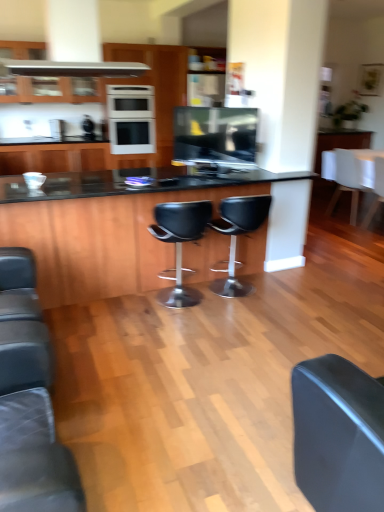
Image resolution: width=384 pixels, height=512 pixels. I want to click on free point in front of black glass table at center, so click(160, 381).